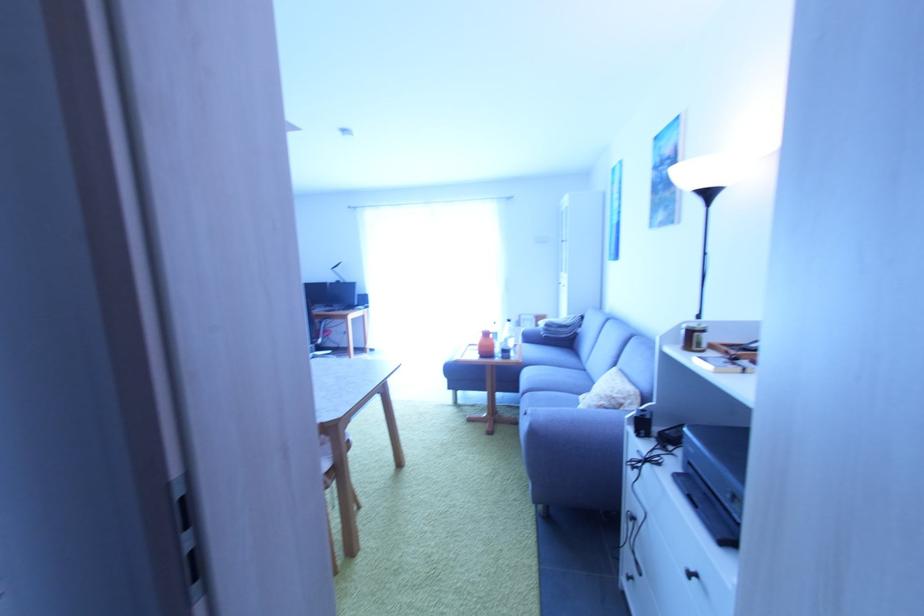
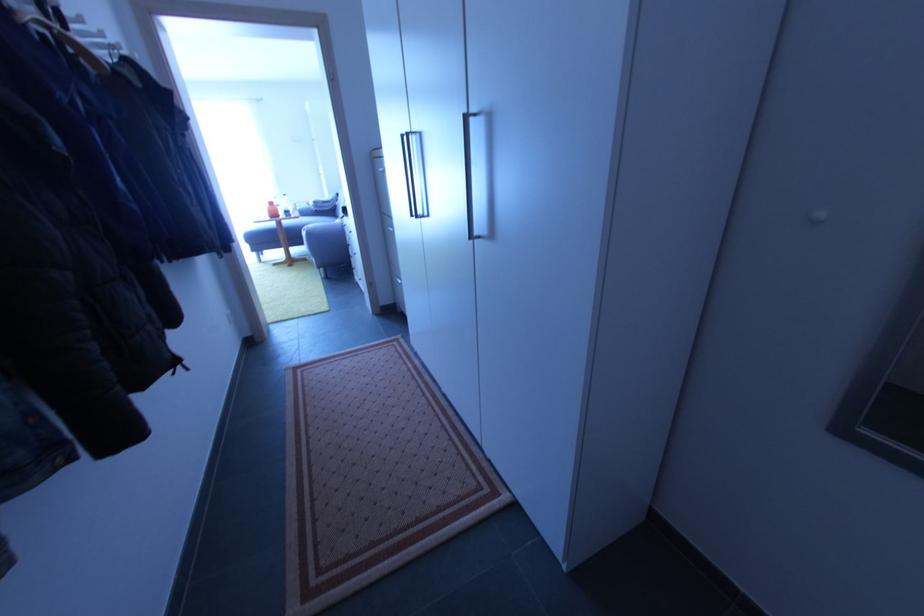
The point at (533, 339) is marked in the first image. Where is the corresponding point in the second image?

(310, 216)